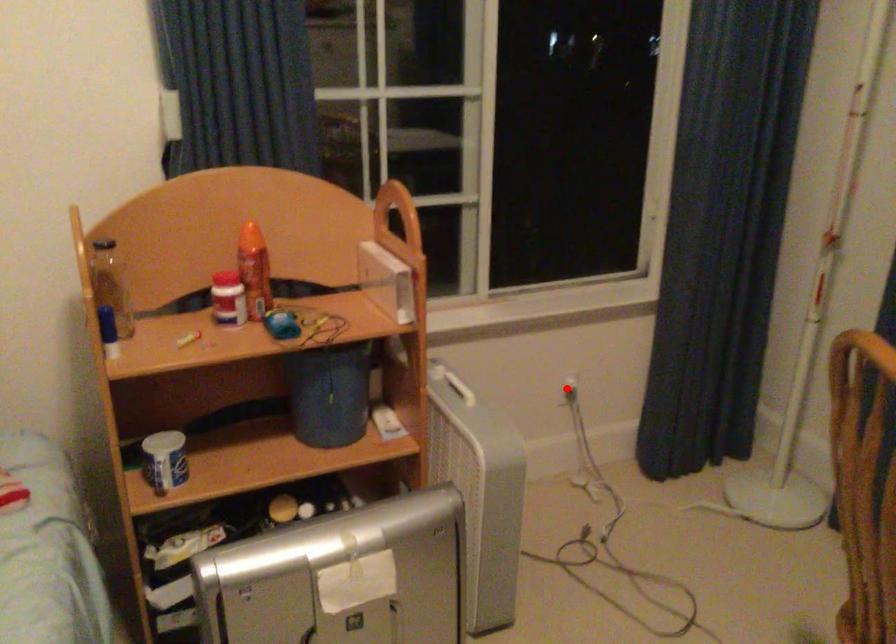
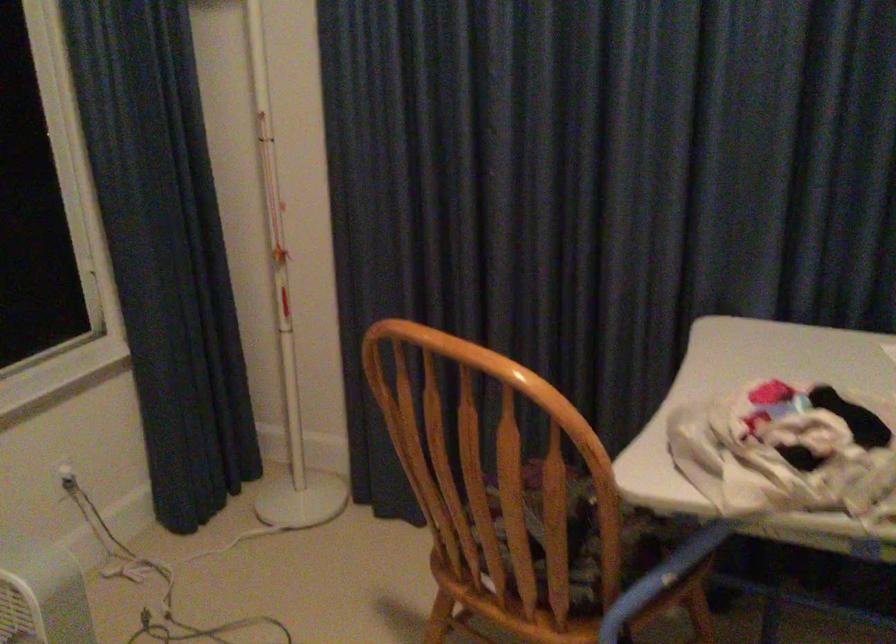
Question: A red point is marked in image1. In image2, is the corresponding 3D point closer to the camera or farther? Reply with the corresponding letter.

Choices:
 (A) The corresponding 3D point is closer.
 (B) The corresponding 3D point is farther.

Answer: (A)